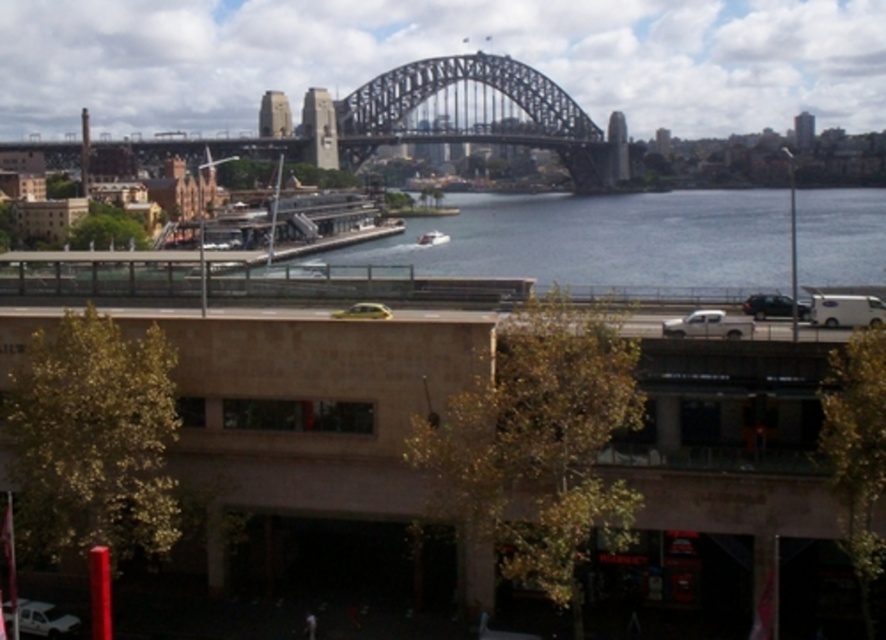
Is white matte van at right shorter than white glossy car at lower left?

In fact, white matte van at right may be taller than white glossy car at lower left.

Does white matte van at right appear on the left side of white glossy car at lower left?

Incorrect, white matte van at right is not on the left side of white glossy car at lower left.

Does point (876, 323) come farther from viewer compared to point (74, 632)?

Yes, it is.

Image resolution: width=886 pixels, height=640 pixels. In order to click on white matte van at right in this screenshot , I will do tap(846, 310).

Does white matte truck at right have a greater height compared to yellow matte taxi at center?

Correct, white matte truck at right is much taller as yellow matte taxi at center.

Can you confirm if white matte truck at right is smaller than yellow matte taxi at center?

Incorrect, white matte truck at right is not smaller in size than yellow matte taxi at center.

Between point (706, 316) and point (348, 312), which one is positioned behind?

Point (348, 312)

Locate an element on the screen. The image size is (886, 640). white matte truck at right is located at coordinates (708, 324).

Which is more to the right, white glossy car at lower left or shiny black sedan at center?

Positioned to the right is shiny black sedan at center.

Is point (53, 634) positioned before point (752, 310)?

Yes, point (53, 634) is in front of point (752, 310).

Is point (68, 627) more distant than point (783, 314)?

No, it is not.

Identify the location of white glossy car at lower left. (45, 620).